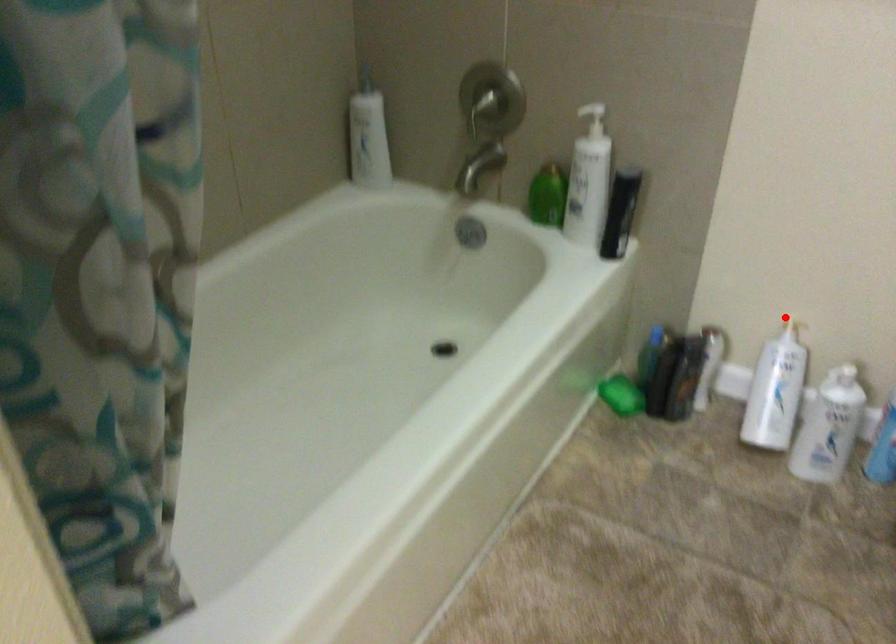
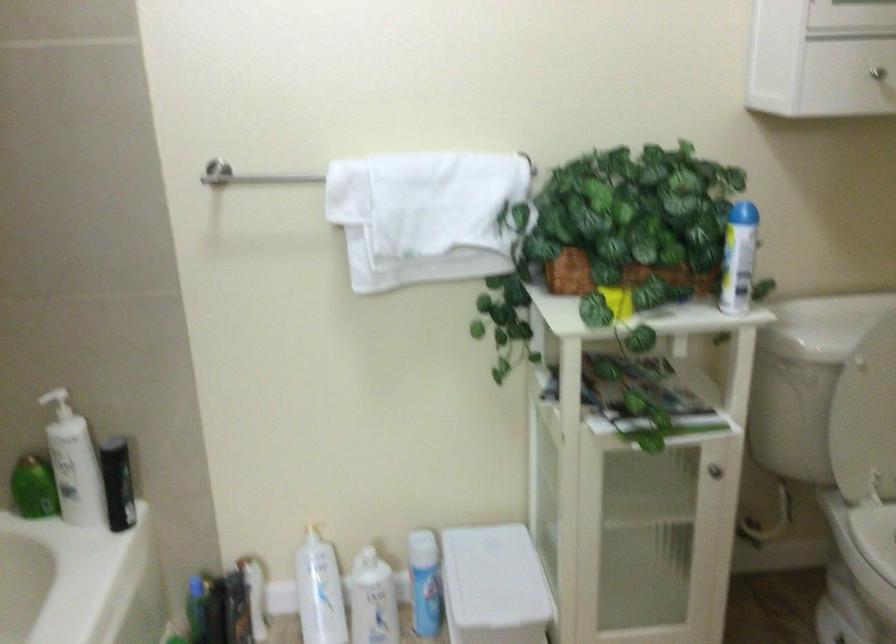
Question: I am providing you with two images of the same scene from different viewpoints. A red point is shown in image1. For the corresponding object point in image2, is it positioned nearer or farther from the camera?

Choices:
 (A) Nearer
 (B) Farther

Answer: (B)